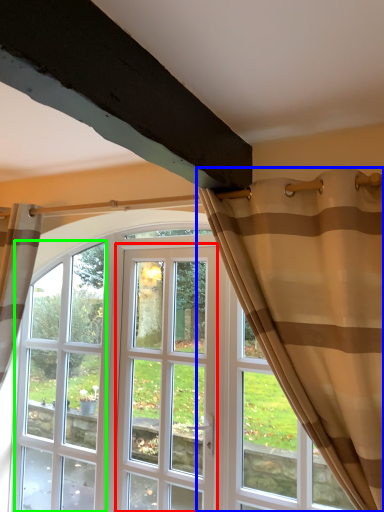
Question: Estimate the real-world distances between objects in this image. Which object is closer to screen door (highlighted by a red box), curtain (highlighted by a blue box) or window (highlighted by a green box)?

Choices:
 (A) curtain
 (B) window

Answer: (B)